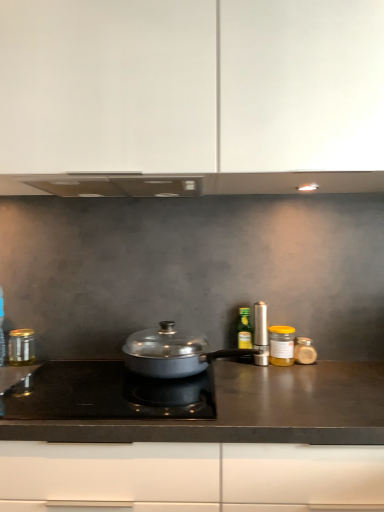
Identify the location of free point to the right of silver metallic salt shaker at right, which is counted as the fourth kitchen appliance, starting from the left. (319, 369).